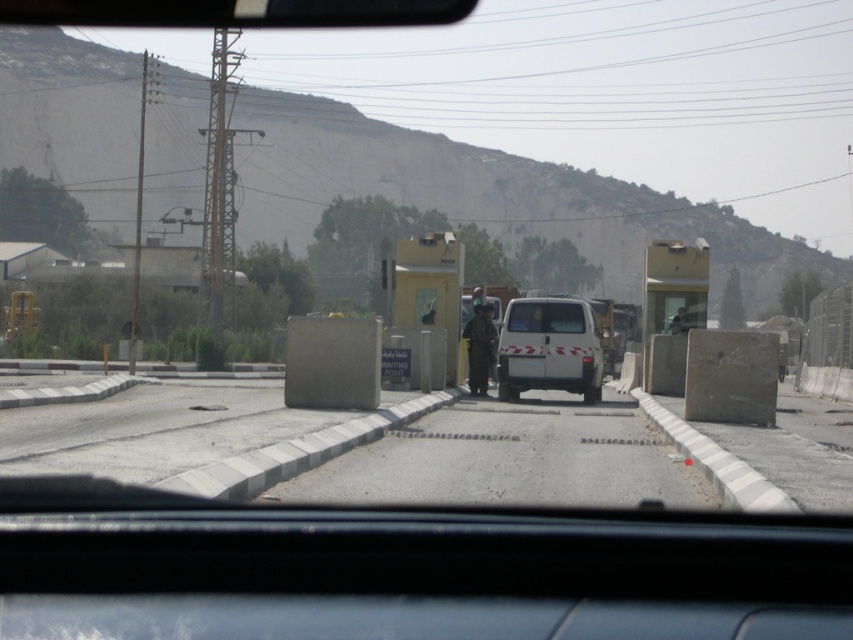
Question: Is white matte van at center to the left of camouflage uniform at center from the viewer's perspective?

Choices:
 (A) no
 (B) yes

Answer: (A)

Question: Which point appears closest to the camera in this image?

Choices:
 (A) (486, 372)
 (B) (573, 308)
 (C) (582, 307)

Answer: (C)

Question: Is white matte van at center closer to the viewer compared to camouflage uniform at center?

Choices:
 (A) no
 (B) yes

Answer: (B)

Question: Based on their relative distances, which object is farther from the clear glass windshield at center?

Choices:
 (A) white matte van at center
 (B) camouflage uniform at center

Answer: (B)

Question: Which point appears farthest from the camera in this image?

Choices:
 (A) (521, 305)
 (B) (485, 378)
 (C) (518, 364)

Answer: (B)

Question: Does white matte van at center appear on the left side of camouflage uniform at center?

Choices:
 (A) yes
 (B) no

Answer: (B)